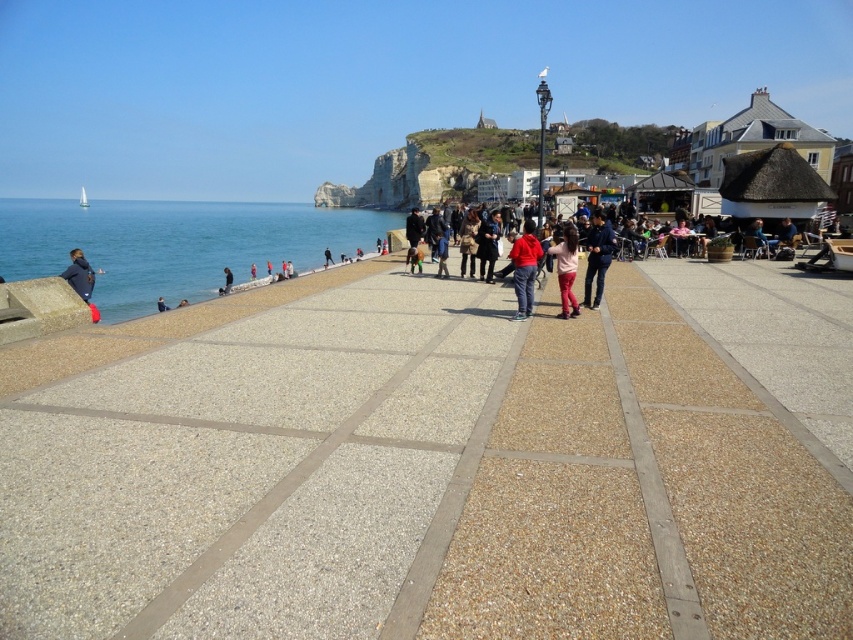
Question: Among these points, which one is farthest from the camera?

Choices:
 (A) (231, 275)
 (B) (518, 268)
 (C) (80, 275)
 (D) (164, 301)

Answer: (A)

Question: Which of the following is the farthest from the observer?

Choices:
 (A) rocky cliff at upper center
 (B) black fabric person at lower left
 (C) matte red jacket at center
 (D) matte blue jacket at left

Answer: (A)

Question: Is matte black jacket at center above dark blue jeans at lower left?

Choices:
 (A) yes
 (B) no

Answer: (A)

Question: Is blue water at left above black fabric person at lower left?

Choices:
 (A) yes
 (B) no

Answer: (A)

Question: Is matte blue jacket at left to the left of dark blue jeans at lower left from the viewer's perspective?

Choices:
 (A) yes
 (B) no

Answer: (B)

Question: Which of the following is the farthest from the observer?

Choices:
 (A) rocky cliff at upper center
 (B) matte red jacket at center
 (C) blue water at left
 (D) pink fabric pants at center

Answer: (A)